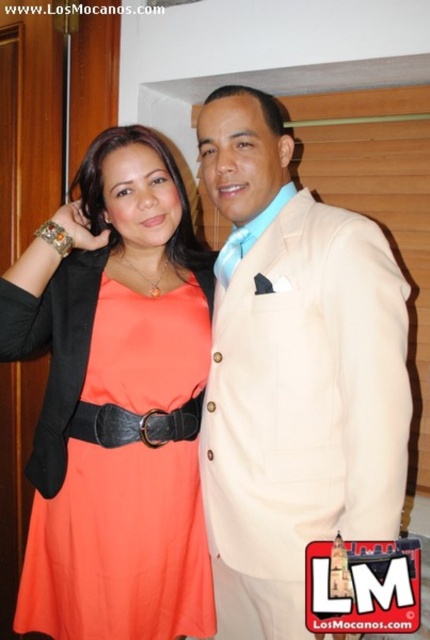
In the scene shown: Can you confirm if beige fabric suit at center is wider than black leather belt at center?

Indeed, beige fabric suit at center has a greater width compared to black leather belt at center.

Who is positioned more to the left, beige fabric suit at center or black leather belt at center?

black leather belt at center is more to the left.

I want to click on beige fabric suit at center, so click(x=294, y=372).

Who is shorter, coral fabric dress at center or black leather belt at center?

With less height is black leather belt at center.

Does coral fabric dress at center have a lesser height compared to black leather belt at center?

No.

Which is in front, point (138, 369) or point (150, 419)?

Point (138, 369) is more forward.

You are a GUI agent. You are given a task and a screenshot of the screen. Output one action in this format:
    pyautogui.click(x=<x>, y=<y>)
    Task: Click on the coral fabric dress at center
    
    Given the screenshot: What is the action you would take?
    [x=111, y=460]

Is beige fabric suit at center bigger than coral fabric dress at center?

Indeed, beige fabric suit at center has a larger size compared to coral fabric dress at center.

Which of these two, beige fabric suit at center or coral fabric dress at center, stands taller?

beige fabric suit at center is taller.

The width and height of the screenshot is (430, 640). In order to click on beige fabric suit at center in this screenshot , I will do `click(294, 372)`.